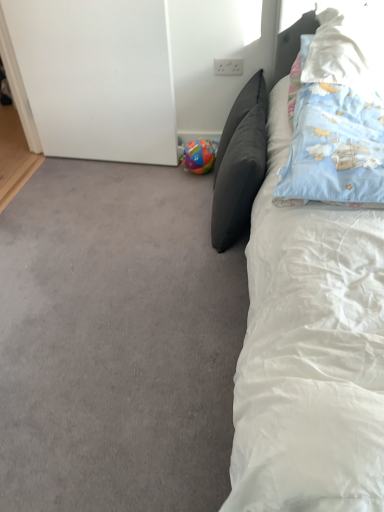
Locate an element on the screen. Image resolution: width=384 pixels, height=512 pixels. vacant space situated on the left part of dark gray cushion at center, positioned as the third pillow in right-to-left order is located at coordinates (160, 223).